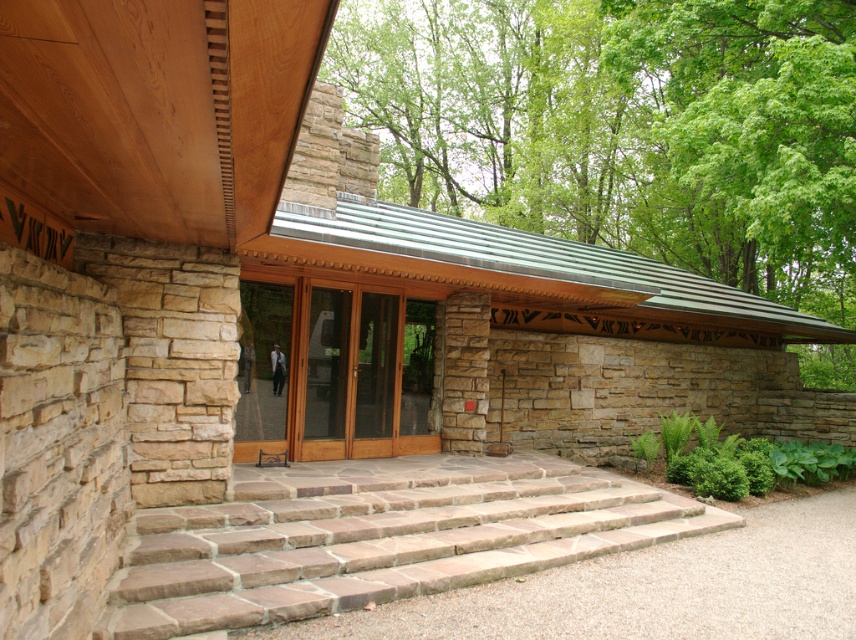
You are a delivery person standing at the entrance of the building. You need to deliver a package to the office located near the green leafy tree at upper center. The path between you and the tree is blocked by the brown stone stairs at center. Can you go around the stairs to reach the tree without crossing them?

The distance between the green leafy tree at upper center and the brown stone stairs at center is 13.70 meters. Since the stairs are blocking the path, you can go around them as there is sufficient space to navigate around the stairs to reach the tree without crossing them.

You are standing at the entrance of the modern architectural structure. You notice a point marked at coordinates (625, 125). Based on the scene description, what object is located at this point?

The point at coordinates (625, 125) corresponds to a green leafy tree at upper center.

You are standing at the entrance of the modern architectural structure and want to enter through the wooden glass doors at center. However, you notice brown stone stairs at center nearby. Are the stairs located to the right or left side of the doors?

The brown stone stairs at center is positioned on the right side of wooden glass doors at center, so the stairs are to the right of the doors.